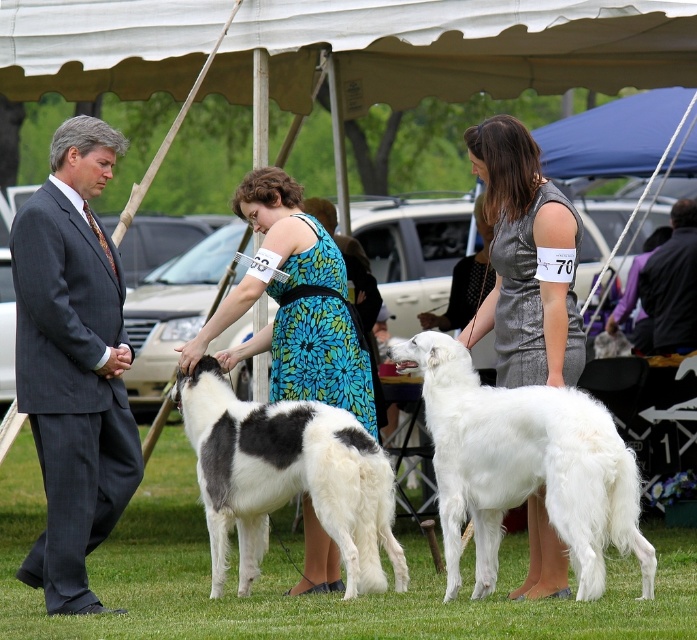
From the picture: You are a photographer at the dog show. You need to capture a photo where both the gray pinstripe suit at left and the black and white fur at center are visible. Considering their heights, which object should be placed closer to the camera to ensure both are fully visible in the frame?

The gray pinstripe suit at left is taller than the black and white fur at center. To ensure both are fully visible, place the taller gray pinstripe suit at left closer to the camera so its full height can be captured without cropping the black and white fur at center.

You are a photographer at the dog show and need to capture a photo of the gray pinstripe suit at left and the black and white fur at center. Which object is narrower in the image?

The gray pinstripe suit at left is thinner than the black and white fur at center, so the gray pinstripe suit at left is narrower in the image.